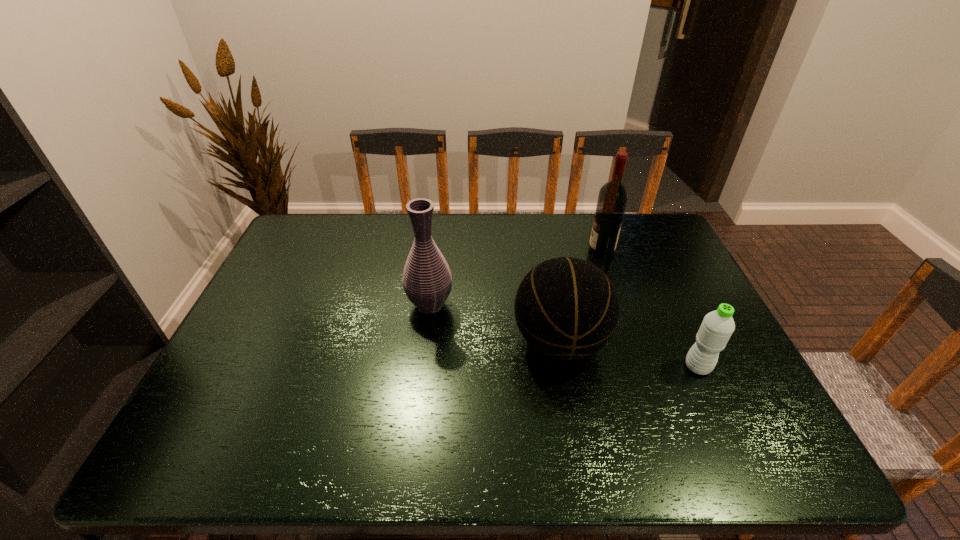
At what (x,y) coordinates should I click in order to perform the action: click on vacant area situated on the right of the vase. Please return your answer as a coordinate pair (x, y). Looking at the image, I should click on (520, 304).

In order to click on vacant space situated on the back of the second shortest object in this screenshot , I will do `click(549, 280)`.

Find the location of `vacant space located 0.240m on the back of the shortest object`. vacant space located 0.240m on the back of the shortest object is located at coordinates (663, 292).

Where is `object at the far edge`? The image size is (960, 540). object at the far edge is located at coordinates point(613,195).

At what (x,y) coordinates should I click in order to perform the action: click on object that is at the right edge. Please return your answer as a coordinate pair (x, y). Looking at the image, I should click on (717, 327).

Locate an element on the screen. vacant space at the far edge of the desktop is located at coordinates pos(474,237).

This screenshot has height=540, width=960. In the image, there is a desktop. Identify the location of vacant space at the near edge. (595, 450).

In order to click on free space at the left edge of the desktop in this screenshot , I will do `click(312, 294)`.

At what (x,y) coordinates should I click in order to perform the action: click on vacant space at the right edge of the desktop. Please return your answer as a coordinate pair (x, y). Looking at the image, I should click on (695, 316).

Find the location of a particular element. This screenshot has height=540, width=960. vacant space at the far left corner of the desktop is located at coordinates (299, 244).